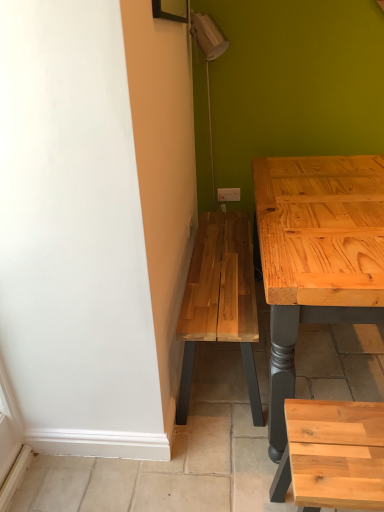
Locate an element on the screen. This screenshot has height=512, width=384. free space above natural wood stool at lower right (from a real-world perspective) is located at coordinates (340, 440).